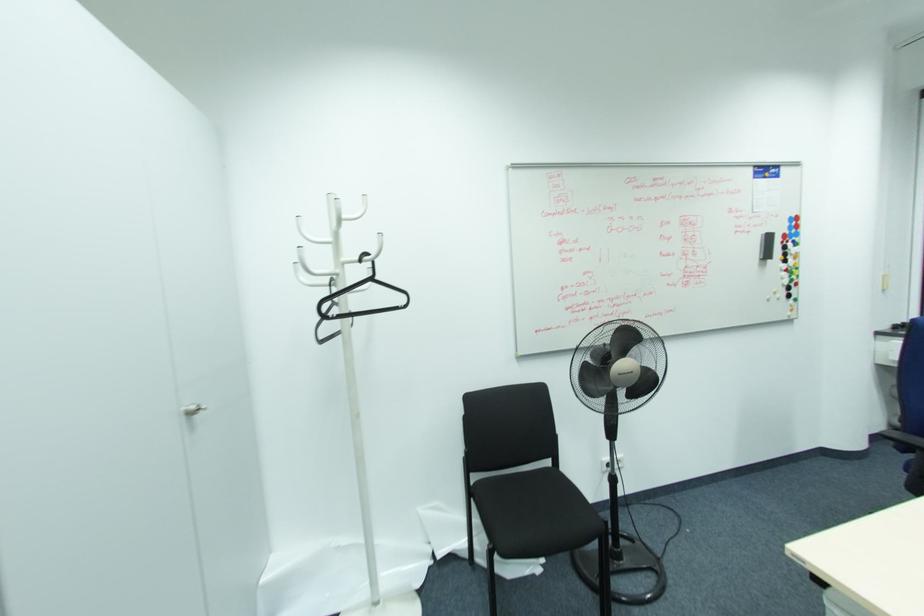
What do you see at coordinates (343, 276) in the screenshot? This screenshot has width=924, height=616. I see `the white coat rack hook` at bounding box center [343, 276].